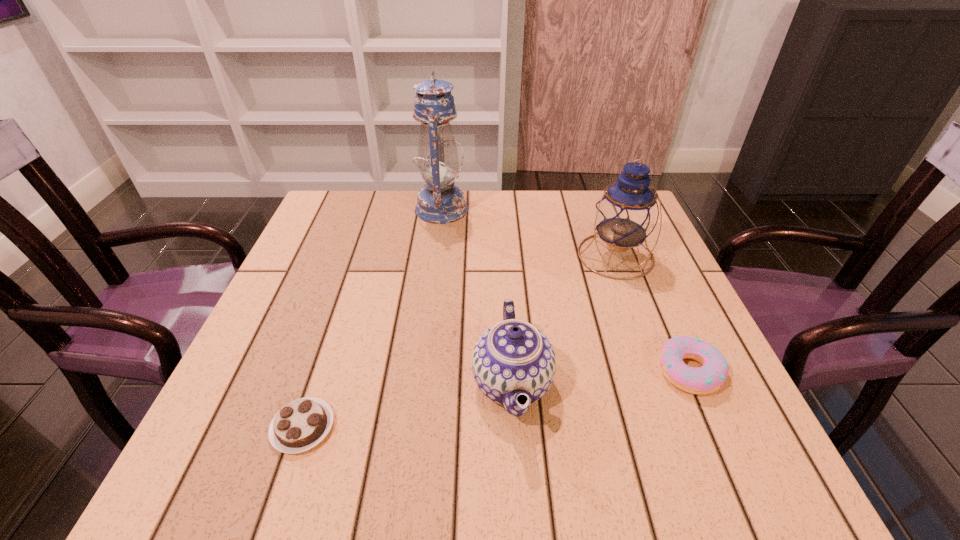
Select which object appears as the third closest to the fourth nearest object. Please provide its 2D coordinates. Your answer should be formatted as a tuple, i.e. [(x, y)], where the tuple contains the x and y coordinates of a point satisfying the conditions above.

[(440, 202)]

Locate an element on the screen. the third closest object relative to the shortest object is located at coordinates (707, 379).

This screenshot has width=960, height=540. In order to click on vacant space that satisfies the following two spatial constraints: 1. on the front-facing side of the fourth tallest object; 2. on the right side of the farther lantern in this screenshot , I will do `click(422, 370)`.

Find the location of `vacant space that satisfies the following two spatial constraints: 1. on the front side of the fourth tallest object; 2. at the spout of the chinaware`. vacant space that satisfies the following two spatial constraints: 1. on the front side of the fourth tallest object; 2. at the spout of the chinaware is located at coordinates (695, 383).

I want to click on vacant space that satisfies the following two spatial constraints: 1. on the front side of the fourth tallest object; 2. at the spout of the chinaware, so click(695, 383).